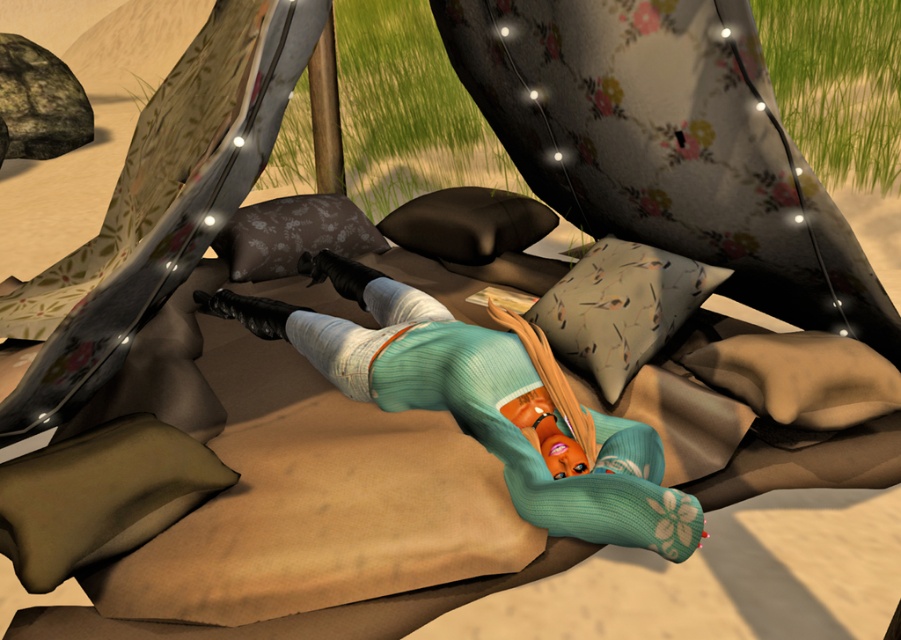
Does dark olive green fabric pillow at lower left appear on the right side of gray fabric pillow with bird pattern at center?

No, dark olive green fabric pillow at lower left is not to the right of gray fabric pillow with bird pattern at center.

Which is below, dark olive green fabric pillow at lower left or gray fabric pillow with bird pattern at center?

dark olive green fabric pillow at lower left is below.

Is point (12, 509) positioned behind point (669, 289)?

That is False.

Where is `dark olive green fabric pillow at lower left`? Image resolution: width=901 pixels, height=640 pixels. dark olive green fabric pillow at lower left is located at coordinates coord(99,496).

Between floral fabric pillow at upper center and black matte pillow at center, which one has less height?

black matte pillow at center

What do you see at coordinates (292, 234) in the screenshot? I see `floral fabric pillow at upper center` at bounding box center [292, 234].

I want to click on floral fabric pillow at upper center, so click(292, 234).

Does gray fabric pillow with bird pattern at center appear over floral fabric pillow at upper center?

Actually, gray fabric pillow with bird pattern at center is below floral fabric pillow at upper center.

Is point (585, 364) less distant than point (289, 268)?

Yes, point (585, 364) is in front of point (289, 268).

Identify the location of gray fabric pillow with bird pattern at center. (620, 307).